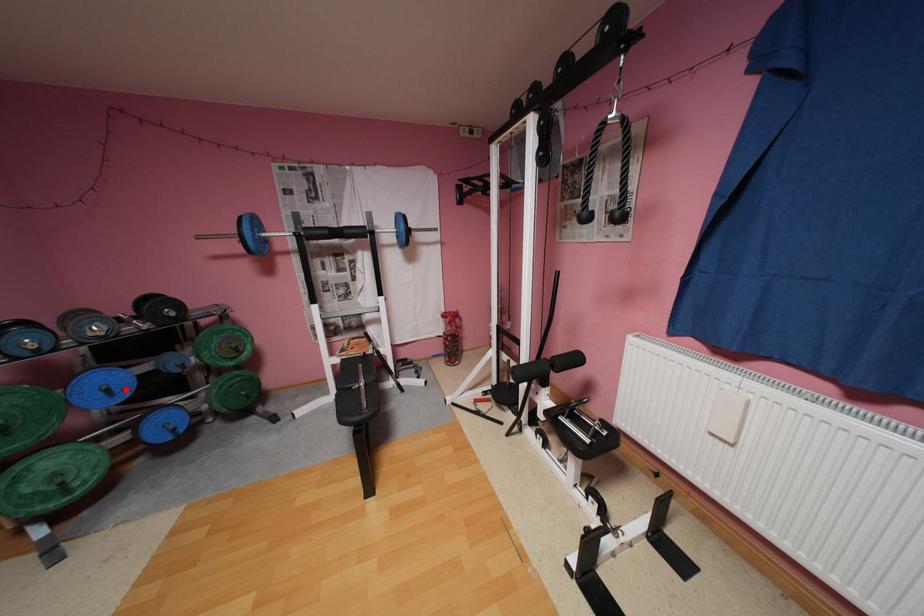
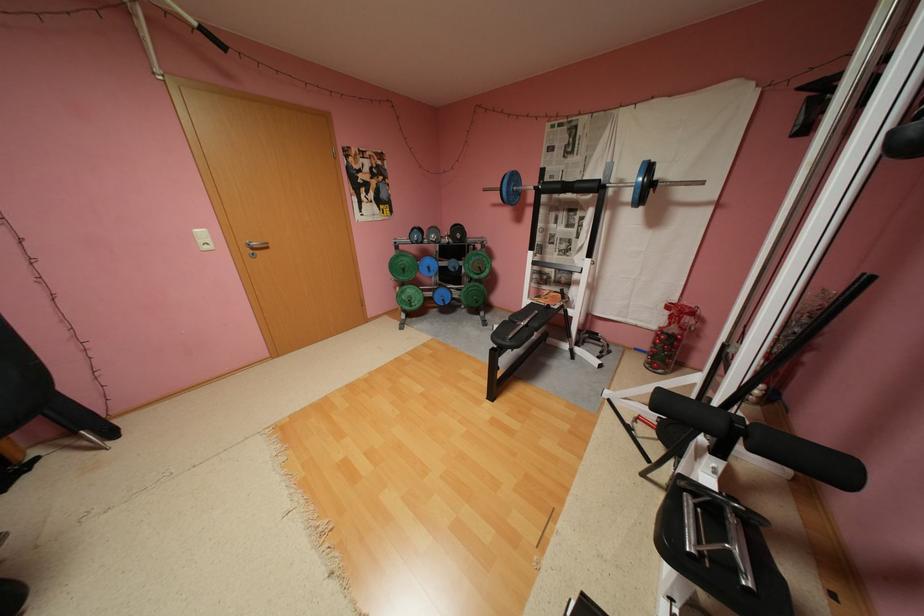
In the second image, find the point that corresponds to the highlighted location in the first image.

(441, 269)